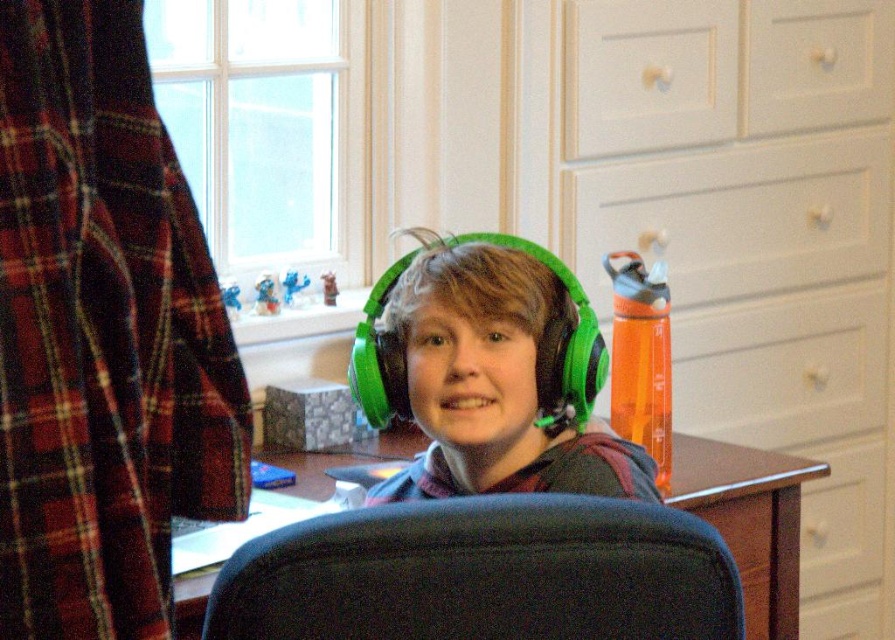
Question: Which object appears farthest from the camera in this image?

Choices:
 (A) black fabric swivel chair at center
 (B) matte orange plastic water bottle at center
 (C) white matte drawer at upper center
 (D) green matte headphones at center

Answer: (C)

Question: Is black fabric swivel chair at center positioned in front of white matte drawer at upper right?

Choices:
 (A) no
 (B) yes

Answer: (B)

Question: Does matte orange plastic water bottle at center have a larger size compared to white matte drawer at upper center?

Choices:
 (A) yes
 (B) no

Answer: (A)

Question: Does green matte headphones at center appear over white matte drawer at upper center?

Choices:
 (A) yes
 (B) no

Answer: (B)

Question: Which object is positioned farthest from the green matte headphones at center?

Choices:
 (A) white matte drawer at upper right
 (B) black fabric swivel chair at center
 (C) white matte drawer at upper center
 (D) matte orange plastic water bottle at center

Answer: (A)

Question: Which point is farther to the camera?

Choices:
 (A) black fabric swivel chair at center
 (B) green matte headphones at center
 (C) matte orange plastic water bottle at center
 (D) white matte drawer at upper right

Answer: (D)